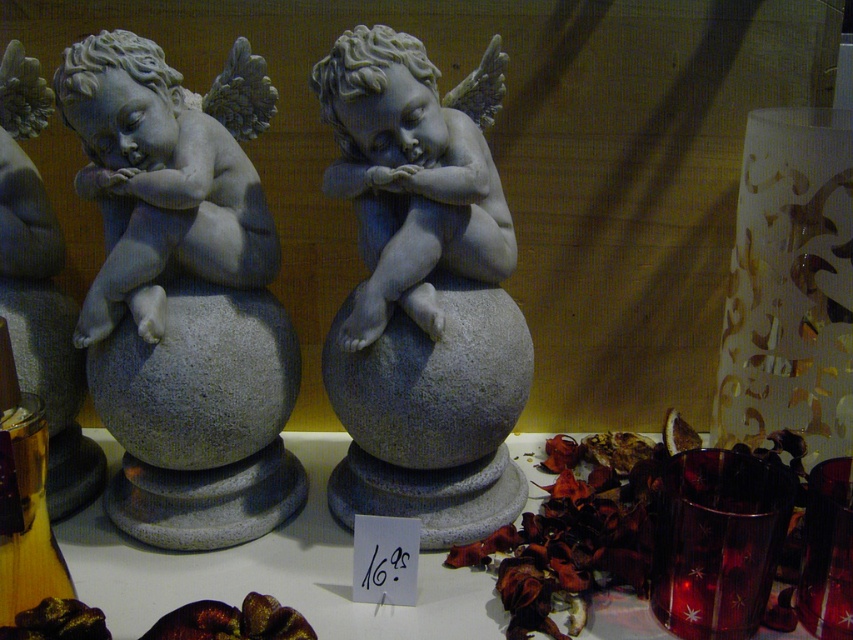
Question: Which object is the closest to the matte stone cherub at center?

Choices:
 (A) wooden bottle at lower left
 (B) white stone cherub at center

Answer: (B)

Question: Which point is closer to the camera taking this photo?

Choices:
 (A) (15, 509)
 (B) (473, 148)

Answer: (A)

Question: Can you confirm if matte stone cherub at center is positioned below wooden bottle at lower left?

Choices:
 (A) yes
 (B) no

Answer: (B)

Question: Is matte stone cherub at center positioned behind wooden bottle at lower left?

Choices:
 (A) yes
 (B) no

Answer: (A)

Question: Does white stone cherub at center have a greater width compared to wooden bottle at lower left?

Choices:
 (A) no
 (B) yes

Answer: (B)

Question: Which of the following is the closest to the observer?

Choices:
 (A) matte stone cherub at center
 (B) white stone cherub at center

Answer: (A)